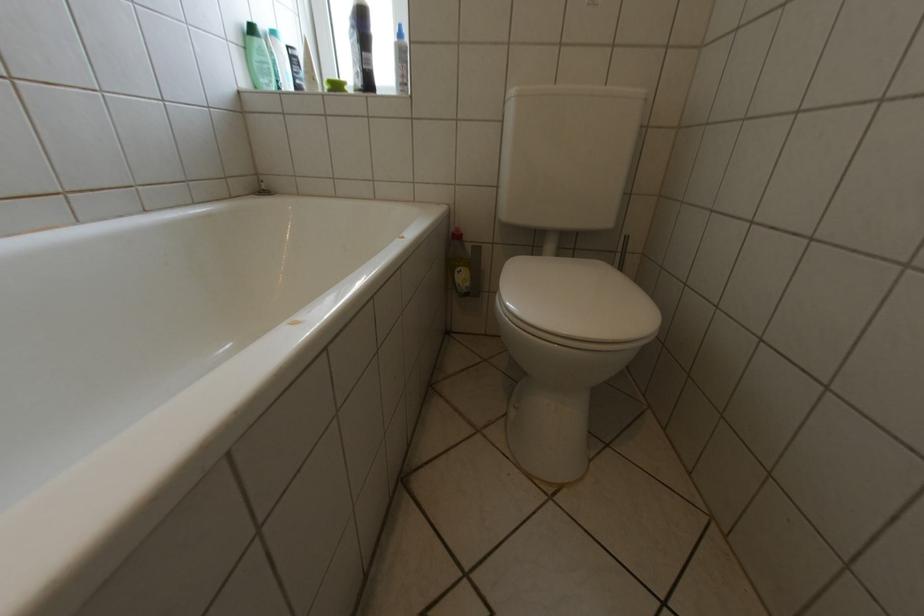
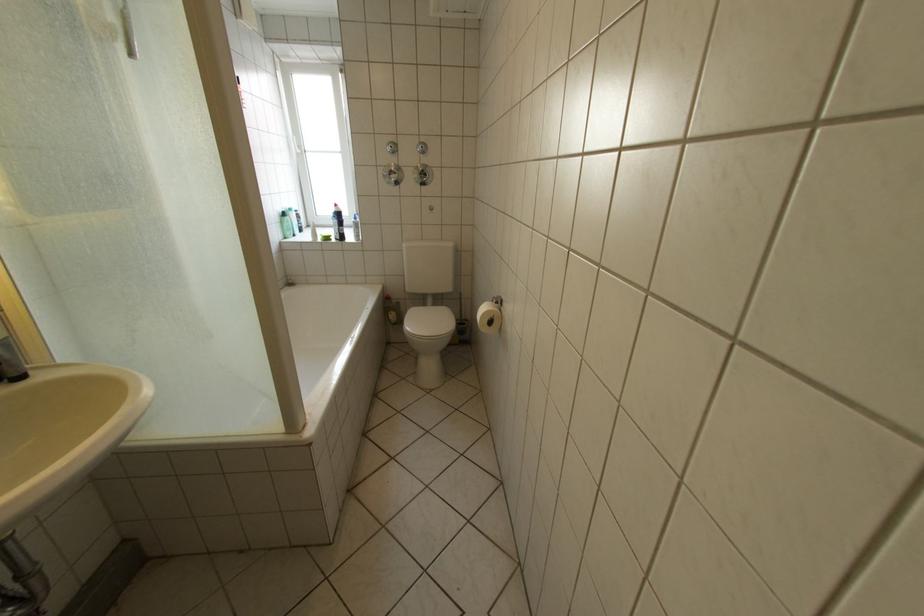
Where in the second image is the point corresponding to pixel 480 285 from the first image?

(407, 320)